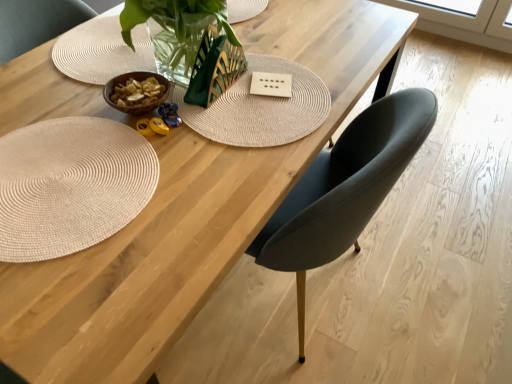
Where is `vacant space behind white matte card at center`? This screenshot has height=384, width=512. vacant space behind white matte card at center is located at coordinates (283, 58).